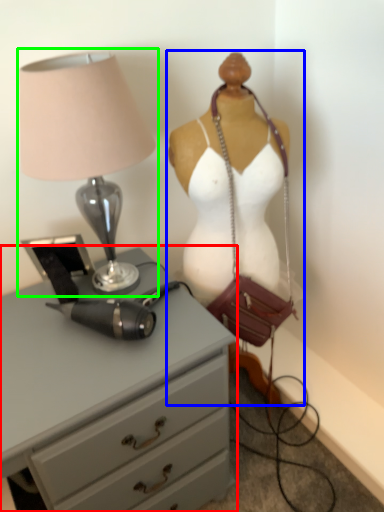
Question: Considering the real-world distances, which object is closest to chest of drawers (highlighted by a red box)? mannequin (highlighted by a blue box) or lamp (highlighted by a green box).

Choices:
 (A) mannequin
 (B) lamp

Answer: (A)